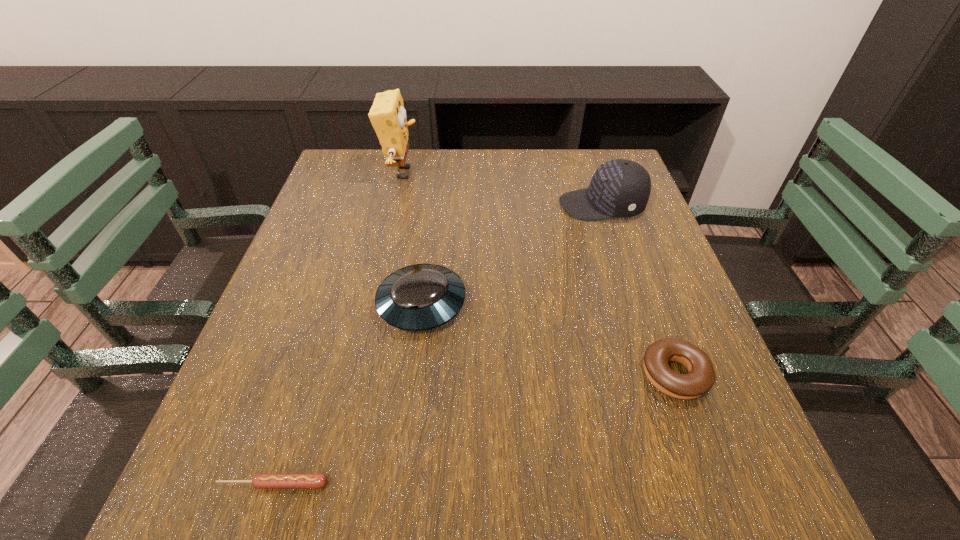
Where is `baseball cap positioned at the right edge`? baseball cap positioned at the right edge is located at coordinates (620, 188).

Find the location of a particular element. doughnut at the right edge is located at coordinates (700, 378).

Identify the location of object that is at the far left corner. The image size is (960, 540). (387, 115).

Identify the location of object that is at the near left corner. Image resolution: width=960 pixels, height=540 pixels. (260, 481).

Locate an element on the screen. The image size is (960, 540). object that is at the far right corner is located at coordinates (620, 188).

The height and width of the screenshot is (540, 960). Find the location of `vacant space at the far edge of the desktop`. vacant space at the far edge of the desktop is located at coordinates (547, 191).

At what (x,y) coordinates should I click in order to perform the action: click on free region at the near edge. Please return your answer as a coordinate pair (x, y). Image resolution: width=960 pixels, height=540 pixels. Looking at the image, I should click on (552, 528).

Find the location of a particular element. This screenshot has width=960, height=540. vacant space at the left edge of the desktop is located at coordinates (337, 305).

I want to click on free space at the right edge of the desktop, so click(653, 247).

Identify the location of free spot at the far left corner of the desktop. Image resolution: width=960 pixels, height=540 pixels. (355, 177).